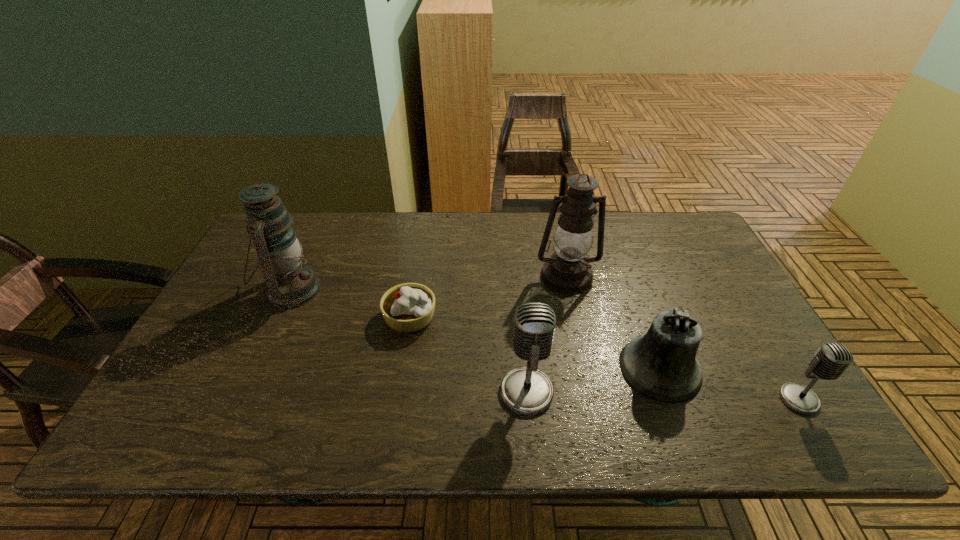
Considering the uniform spacing of microphones, where should an additional microphone be positioned on the left? Please locate a free spot. Please provide its 2D coordinates. Your answer should be formatted as a tuple, i.e. [(x, y)], where the tuple contains the x and y coordinates of a point satisfying the conditions above.

[(262, 384)]